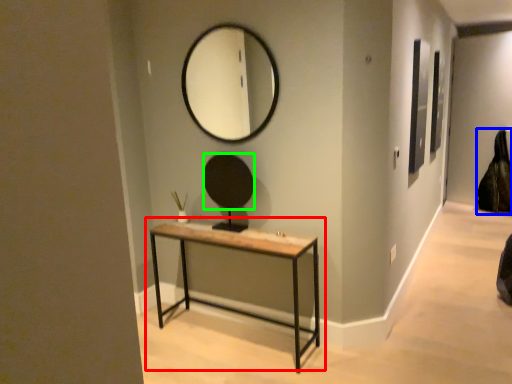
Question: Estimate the real-world distances between objects in this image. Which object is farther from table (highlighted by a red box), swivel chair (highlighted by a blue box) or mirror (highlighted by a green box)?

Choices:
 (A) swivel chair
 (B) mirror

Answer: (A)